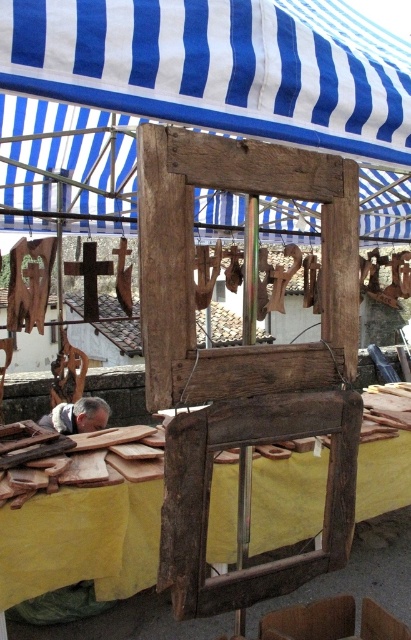
Who is more forward, (367, 74) or (62, 432)?

Point (367, 74) is in front.

Between point (71, 86) and point (89, 426), which one is positioned behind?

Positioned behind is point (89, 426).

Which is behind, point (30, 154) or point (99, 413)?

Positioned behind is point (30, 154).

Locate an element on the screen. The image size is (411, 640). blue striped fabric at upper center is located at coordinates (205, 90).